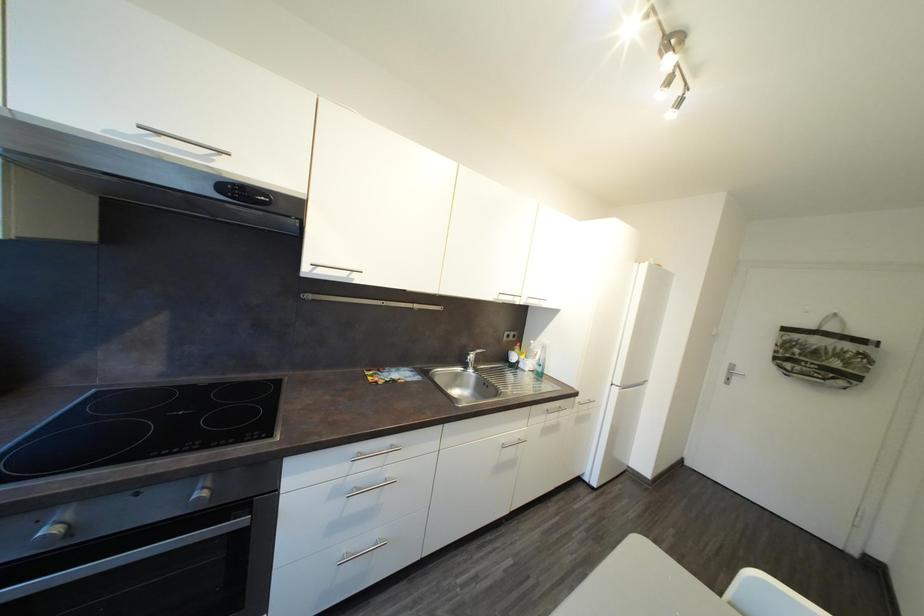
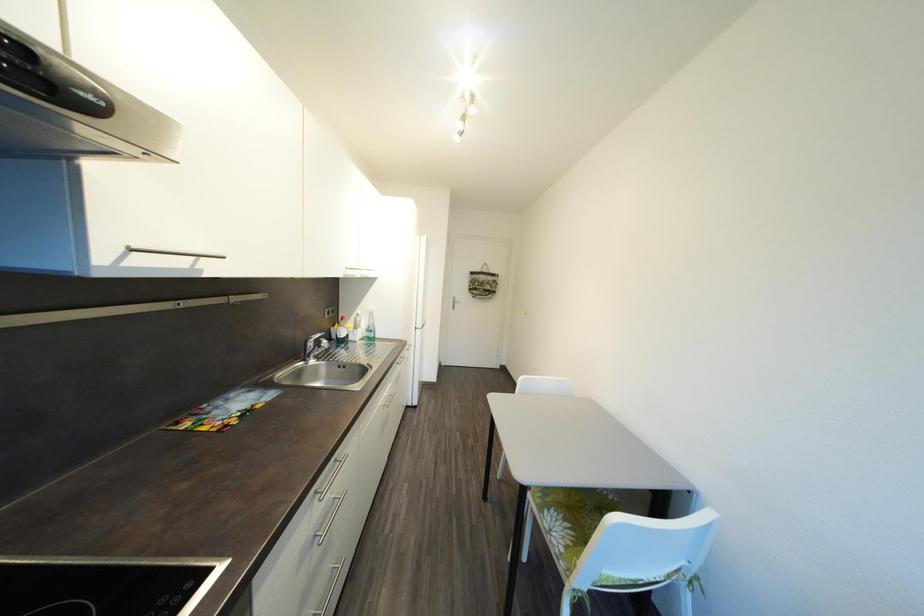
Question: How did the camera likely rotate?

Choices:
 (A) Left
 (B) Right
 (C) Up
 (D) Down

Answer: (B)